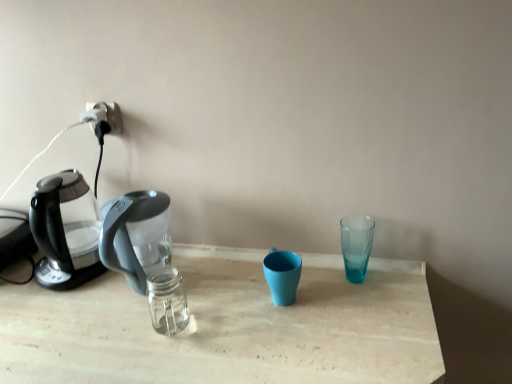
The height and width of the screenshot is (384, 512). I want to click on matte blue cup at center, the 2th coffee cup when ordered from right to left, so click(282, 275).

Image resolution: width=512 pixels, height=384 pixels. In order to click on transparent plastic kettle at left in this screenshot , I will do `click(65, 231)`.

Is white plastic plug at upper left facing towards transparent glass at right, which is counted as the 2th coffee cup, starting from the left?

No, white plastic plug at upper left is not facing towards transparent glass at right, which is counted as the 2th coffee cup, starting from the left.

Are white plastic plug at upper left and transparent glass at right, which is counted as the 2th coffee cup, starting from the left, located far from each other?

No, there isn't a large distance between white plastic plug at upper left and transparent glass at right, which is counted as the 2th coffee cup, starting from the left.

Visually, is white plastic plug at upper left positioned to the left or to the right of transparent glass at right, the first coffee cup in the right-to-left sequence?

In the image, white plastic plug at upper left appears on the left side of transparent glass at right, the first coffee cup in the right-to-left sequence.

Which is correct: white plastic plug at upper left is inside transparent glass at right, which is counted as the 2th coffee cup, starting from the left, or outside of it?

white plastic plug at upper left is not inside transparent glass at right, which is counted as the 2th coffee cup, starting from the left, it's outside.

Considering the sizes of transparent plastic kettle at left and transparent glass at right, the first coffee cup in the right-to-left sequence, in the image, is transparent plastic kettle at left taller or shorter than transparent glass at right, the first coffee cup in the right-to-left sequence,?

Clearly, transparent plastic kettle at left is taller compared to transparent glass at right, the first coffee cup in the right-to-left sequence.

Looking at the image, does transparent plastic kettle at left seem bigger or smaller compared to transparent glass at right, which is counted as the 2th coffee cup, starting from the left?

transparent plastic kettle at left is bigger than transparent glass at right, which is counted as the 2th coffee cup, starting from the left.

Does transparent plastic kettle at left have a greater width compared to transparent glass at right, the first coffee cup in the right-to-left sequence?

Yes, transparent plastic kettle at left is wider than transparent glass at right, the first coffee cup in the right-to-left sequence.

Which is behind, transparent plastic kettle at left or transparent glass at right, the first coffee cup in the right-to-left sequence?

transparent glass at right, the first coffee cup in the right-to-left sequence, is more distant.

Is white plastic plug at upper left wider or thinner than matte blue cup at center, which is counted as the 1th coffee cup, starting from the left?

In the image, white plastic plug at upper left appears to be more narrow than matte blue cup at center, which is counted as the 1th coffee cup, starting from the left.

From a real-world perspective, which is physically below, white plastic plug at upper left or matte blue cup at center, the 2th coffee cup when ordered from right to left?

In real-world perspective, matte blue cup at center, the 2th coffee cup when ordered from right to left, is lower.

Is white plastic plug at upper left completely or partially outside of matte blue cup at center, the 2th coffee cup when ordered from right to left?

white plastic plug at upper left lies outside matte blue cup at center, the 2th coffee cup when ordered from right to left,'s area.

Looking at the image, does white plastic plug at upper left seem bigger or smaller compared to matte blue cup at center, which is counted as the 1th coffee cup, starting from the left?

white plastic plug at upper left is smaller than matte blue cup at center, which is counted as the 1th coffee cup, starting from the left.

Which is farther, (74, 170) or (287, 270)?

Point (74, 170)

Is the position of transparent plastic kettle at left less distant than that of matte blue cup at center, which is counted as the 1th coffee cup, starting from the left?

No, transparent plastic kettle at left is further to the viewer.

In the scene shown: Which is more to the right, transparent plastic kettle at left or matte blue cup at center, which is counted as the 1th coffee cup, starting from the left?

Positioned to the right is matte blue cup at center, which is counted as the 1th coffee cup, starting from the left.

Between transparent plastic kettle at left and matte blue cup at center, the 2th coffee cup when ordered from right to left, which one has smaller width?

matte blue cup at center, the 2th coffee cup when ordered from right to left, is thinner.

Is white plastic plug at upper left far from transparent plastic kettle at left?

No.

Is white plastic plug at upper left aimed at transparent plastic kettle at left?

No, white plastic plug at upper left is not oriented towards transparent plastic kettle at left.

Locate an element on the screen. power plugs and sockets above the transparent plastic kettle at left (from the image's perspective) is located at coordinates (103, 116).

What's the angular difference between white plastic plug at upper left and transparent plastic kettle at left's facing directions?

There is a 1.57-degree angle between the facing directions of white plastic plug at upper left and transparent plastic kettle at left.

Which is more to the left, transparent plastic kettle at left or white plastic plug at upper left?

transparent plastic kettle at left is more to the left.

How many degrees apart are the facing directions of transparent plastic kettle at left and white plastic plug at upper left?

They differ by 1.57 degrees in their facing directions.

Could you tell me if transparent plastic kettle at left is facing white plastic plug at upper left?

No, transparent plastic kettle at left is not aimed at white plastic plug at upper left.

Is transparent plastic kettle at left positioned far away from white plastic plug at upper left?

transparent plastic kettle at left is near white plastic plug at upper left, not far away.

Which object is thinner, transparent glass at right, which is counted as the 2th coffee cup, starting from the left, or matte blue cup at center, the 2th coffee cup when ordered from right to left?

transparent glass at right, which is counted as the 2th coffee cup, starting from the left, is thinner.

Who is bigger, transparent glass at right, the first coffee cup in the right-to-left sequence, or matte blue cup at center, which is counted as the 1th coffee cup, starting from the left?

Bigger between the two is matte blue cup at center, which is counted as the 1th coffee cup, starting from the left.

How different are the orientations of transparent glass at right, which is counted as the 2th coffee cup, starting from the left, and matte blue cup at center, the 2th coffee cup when ordered from right to left, in degrees?

The facing directions of transparent glass at right, which is counted as the 2th coffee cup, starting from the left, and matte blue cup at center, the 2th coffee cup when ordered from right to left, are 0.00805 degrees apart.

Is transparent glass at right, the first coffee cup in the right-to-left sequence, looking in the opposite direction of matte blue cup at center, which is counted as the 1th coffee cup, starting from the left?

transparent glass at right, the first coffee cup in the right-to-left sequence, is not turned away from matte blue cup at center, which is counted as the 1th coffee cup, starting from the left.

Where is `power plugs and sockets located above the transparent glass at right, the first coffee cup in the right-to-left sequence (from the image's perspective)`? The height and width of the screenshot is (384, 512). power plugs and sockets located above the transparent glass at right, the first coffee cup in the right-to-left sequence (from the image's perspective) is located at coordinates (103, 116).

From a real-world perspective, starting from the transparent plastic kettle at left, which coffee cup is the 1st one below it? Please provide its 2D coordinates.

[(356, 245)]

Based on their spatial positions, is matte blue cup at center, which is counted as the 1th coffee cup, starting from the left, or transparent glass at right, which is counted as the 2th coffee cup, starting from the left, closer to white plastic plug at upper left?

Among the two, matte blue cup at center, which is counted as the 1th coffee cup, starting from the left, is located nearer to white plastic plug at upper left.

From the image, which object appears to be nearer to matte blue cup at center, the 2th coffee cup when ordered from right to left, transparent glass at right, which is counted as the 2th coffee cup, starting from the left, or white plastic plug at upper left?

transparent glass at right, which is counted as the 2th coffee cup, starting from the left, is positioned closer to the anchor matte blue cup at center, the 2th coffee cup when ordered from right to left.

Considering their positions, is white plastic plug at upper left positioned further to transparent glass at right, the first coffee cup in the right-to-left sequence, than transparent plastic kettle at left?

transparent plastic kettle at left is further to transparent glass at right, the first coffee cup in the right-to-left sequence.

From the image, which object appears to be farther from transparent plastic kettle at left, matte blue cup at center, which is counted as the 1th coffee cup, starting from the left, or white plastic plug at upper left?

Based on the image, matte blue cup at center, which is counted as the 1th coffee cup, starting from the left, appears to be further to transparent plastic kettle at left.

Based on their spatial positions, is transparent plastic kettle at left or white plastic plug at upper left further from transparent glass at right, the first coffee cup in the right-to-left sequence?

transparent plastic kettle at left lies further to transparent glass at right, the first coffee cup in the right-to-left sequence, than the other object.

Considering their positions, is transparent glass at right, which is counted as the 2th coffee cup, starting from the left, positioned closer to matte blue cup at center, which is counted as the 1th coffee cup, starting from the left, than transparent plastic kettle at left?

Based on the image, transparent glass at right, which is counted as the 2th coffee cup, starting from the left, appears to be nearer to matte blue cup at center, which is counted as the 1th coffee cup, starting from the left.

Estimate the real-world distances between objects in this image. Which object is further from matte blue cup at center, the 2th coffee cup when ordered from right to left, transparent plastic kettle at left or white plastic plug at upper left?

white plastic plug at upper left is positioned further to the anchor matte blue cup at center, the 2th coffee cup when ordered from right to left.

Looking at the image, which one is located closer to transparent glass at right, which is counted as the 2th coffee cup, starting from the left, matte blue cup at center, which is counted as the 1th coffee cup, starting from the left, or white plastic plug at upper left?

Based on the image, matte blue cup at center, which is counted as the 1th coffee cup, starting from the left, appears to be nearer to transparent glass at right, which is counted as the 2th coffee cup, starting from the left.

Identify the location of power plugs and sockets between transparent plastic kettle at left and transparent glass at right, the first coffee cup in the right-to-left sequence, in the horizontal direction. The image size is (512, 384). (103, 116).

What are the coordinates of `coffee cup between transparent plastic kettle at left and transparent glass at right, which is counted as the 2th coffee cup, starting from the left` in the screenshot? It's located at (282, 275).

Where is `coffee cup between white plastic plug at upper left and transparent glass at right, the first coffee cup in the right-to-left sequence, in the horizontal direction`? coffee cup between white plastic plug at upper left and transparent glass at right, the first coffee cup in the right-to-left sequence, in the horizontal direction is located at coordinates (282, 275).

You are a GUI agent. You are given a task and a screenshot of the screen. Output one action in this format:
    pyautogui.click(x=<x>, y=<y>)
    Task: Click on the power plugs and sockets between transparent plastic kettle at left and matte blue cup at center, which is counted as the 1th coffee cup, starting from the left, from left to right
    The height and width of the screenshot is (384, 512).
    Given the screenshot: What is the action you would take?
    pyautogui.click(x=103, y=116)